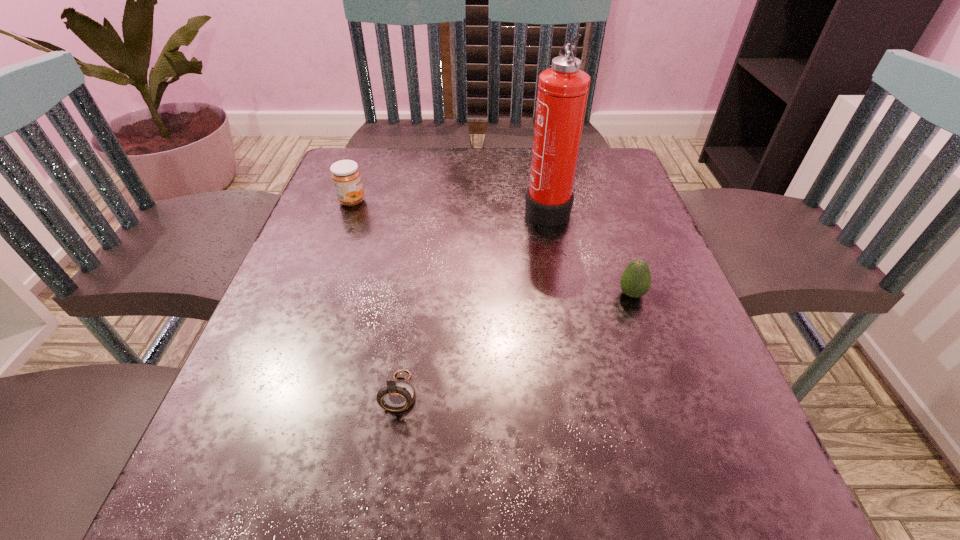
In the image, there is a desktop. Where is `vacant space at the left edge`? This screenshot has width=960, height=540. vacant space at the left edge is located at coordinates (276, 322).

In the image, there is a desktop. Find the location of `vacant space at the right edge`. vacant space at the right edge is located at coordinates (592, 201).

In order to click on free space at the near left corner of the desktop in this screenshot , I will do `click(283, 490)`.

Where is `vacant space at the far right corner of the desktop`? This screenshot has width=960, height=540. vacant space at the far right corner of the desktop is located at coordinates (608, 152).

The image size is (960, 540). I want to click on free space between the third farthest object and the fire extinguisher, so click(589, 251).

Find the location of a particular element. free spot between the fire extinguisher and the leftmost object is located at coordinates (449, 204).

Identify the location of free space between the nearest object and the avocado. This screenshot has height=540, width=960. (516, 343).

Locate an element on the screen. free spot between the rightmost object and the second object from right to left is located at coordinates (589, 251).

Image resolution: width=960 pixels, height=540 pixels. I want to click on free area in between the fire extinguisher and the jam, so click(x=449, y=204).

This screenshot has height=540, width=960. Identify the location of vacant space that's between the third object from left to right and the second nearest object. (589, 251).